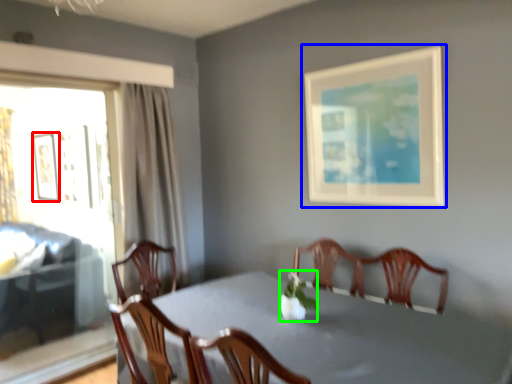
Question: Estimate the real-world distances between objects in this image. Which object is closer to picture frame (highlighted by a red box), picture frame (highlighted by a blue box) or floral arrangement (highlighted by a green box)?

Choices:
 (A) picture frame
 (B) floral arrangement

Answer: (A)